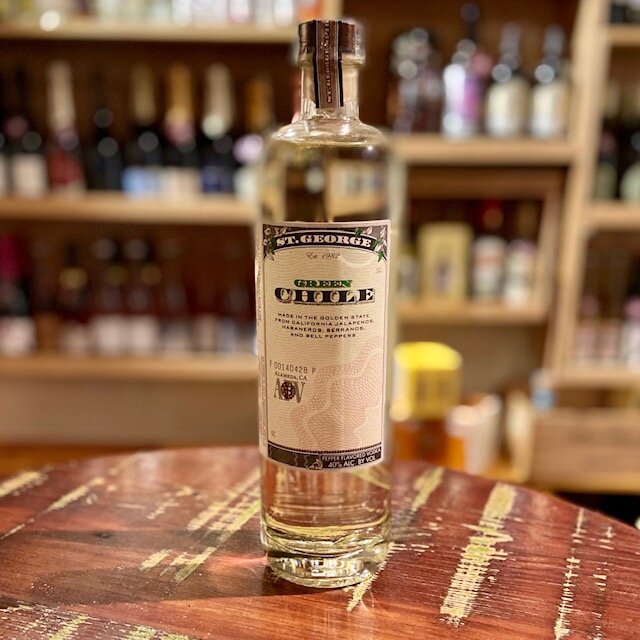
Locate an element on the screen. The image size is (640, 640). table is located at coordinates (454, 516).